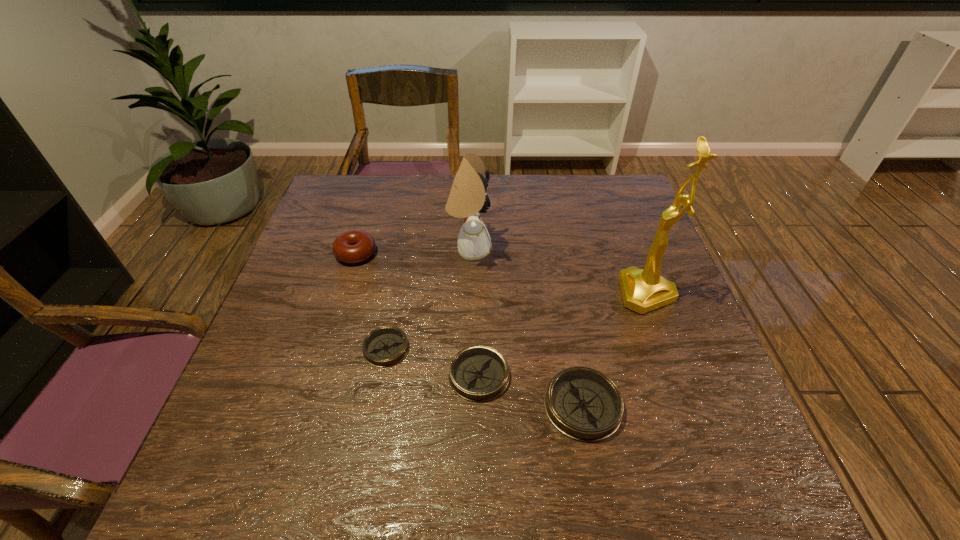
Locate which compass ranks second in proximity to the fifth tallest object. Please provide its 2D coordinates. Your answer should be formatted as a tuple, i.e. [(x, y)], where the tuple contains the x and y coordinates of a point satisfying the conditions above.

[(386, 346)]

You are a GUI agent. You are given a task and a screenshot of the screen. Output one action in this format:
    pyautogui.click(x=<x>, y=<y>)
    Task: Click on the compass identified as the closest to the award
    The image size is (960, 540).
    Given the screenshot: What is the action you would take?
    pyautogui.click(x=584, y=404)

I want to click on free space that satisfies the following two spatial constraints: 1. at the front face of the second tallest object; 2. on the left side of the third shortest object, so click(466, 406).

Locate an element on the screen. The image size is (960, 540). vacant space that satisfies the following two spatial constraints: 1. on the back side of the rightmost compass; 2. at the front face of the doll is located at coordinates (554, 249).

You are a GUI agent. You are given a task and a screenshot of the screen. Output one action in this format:
    pyautogui.click(x=<x>, y=<y>)
    Task: Click on the vacant region that satisfies the following two spatial constraints: 1. on the front side of the doughnut; 2. on the right side of the shortest object
    
    Given the screenshot: What is the action you would take?
    pyautogui.click(x=326, y=348)